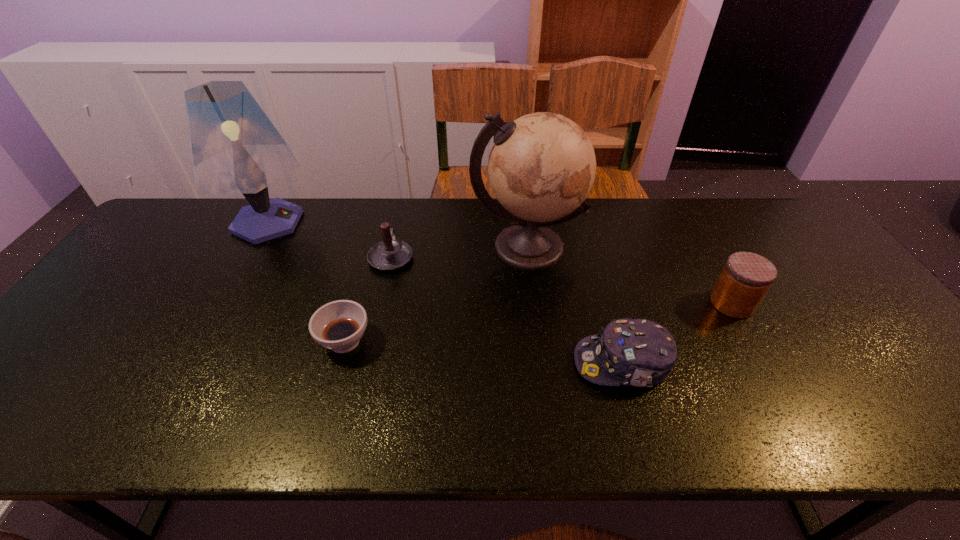
Locate an element on the screen. The image size is (960, 540). the leftmost object is located at coordinates (234, 147).

The height and width of the screenshot is (540, 960). Find the location of `globe`. globe is located at coordinates (541, 168).

Locate an element on the screen. jar is located at coordinates (745, 279).

Locate an element on the screen. The image size is (960, 540). the rightmost object is located at coordinates (745, 279).

Where is `candle`? candle is located at coordinates (390, 254).

Locate an element on the screen. The width and height of the screenshot is (960, 540). headwear is located at coordinates (633, 352).

The image size is (960, 540). Identify the location of the shortest object. (339, 325).

Where is `free location located 0.100m on the base of the lampshade`? free location located 0.100m on the base of the lampshade is located at coordinates (348, 222).

This screenshot has height=540, width=960. I want to click on free location located 0.370m on the front-facing side of the globe, so (544, 397).

Where is `free location located 0.390m on the back of the rightmost object`? This screenshot has height=540, width=960. free location located 0.390m on the back of the rightmost object is located at coordinates pos(678,206).